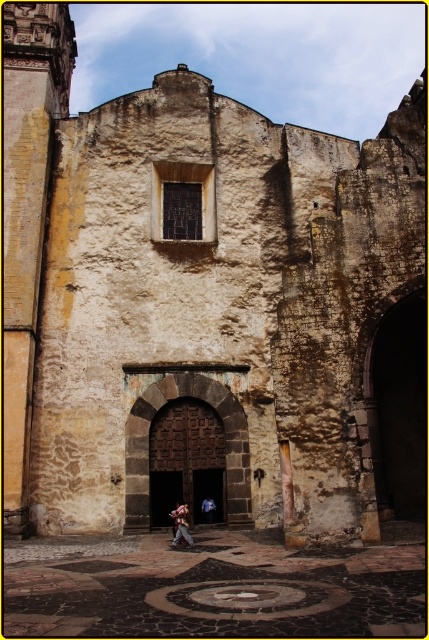
Question: Which of the following is the closest to the observer?

Choices:
 (A) (178, 518)
 (B) (207, 497)

Answer: (A)

Question: Is denim pants at center to the left of blue denim jeans at center from the viewer's perspective?

Choices:
 (A) yes
 (B) no

Answer: (A)

Question: Is denim pants at center closer to the viewer compared to blue denim jeans at center?

Choices:
 (A) yes
 (B) no

Answer: (A)

Question: Is denim pants at center to the right of blue denim jeans at center from the viewer's perspective?

Choices:
 (A) yes
 (B) no

Answer: (B)